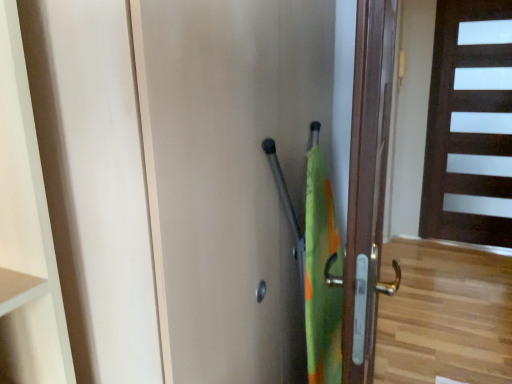
What do you see at coordinates (260, 186) in the screenshot? I see `matte wood door at center, which is the first door in left-to-right order` at bounding box center [260, 186].

Find the location of a particular element. brown wooden door at right, the 2th door when ordered from back to front is located at coordinates (367, 186).

In order to click on dark wood door at right, the 1th door viewed from the back in this screenshot , I will do `click(470, 125)`.

Identify the location of matte wood door at center, positioned as the 1th door in front-to-back order. Image resolution: width=512 pixels, height=384 pixels. (260, 186).

Is dark wood door at right, which is the third door in front-to-back order, aimed at matte wood door at center, marked as the 3th door in a right-to-left arrangement?

Yes, dark wood door at right, which is the third door in front-to-back order, is turned towards matte wood door at center, marked as the 3th door in a right-to-left arrangement.

Which is in front, point (468, 45) or point (316, 232)?

The point (316, 232) is closer.

The height and width of the screenshot is (384, 512). I want to click on door that is the 2nd object to the right of the matte wood door at center, marked as the 3th door in a right-to-left arrangement, starting at the anchor, so click(470, 125).

Considering the positions of objects dark wood door at right, which is the third door in front-to-back order, and matte wood door at center, marked as the 3th door in a right-to-left arrangement, in the image provided, who is in front, dark wood door at right, which is the third door in front-to-back order, or matte wood door at center, marked as the 3th door in a right-to-left arrangement,?

matte wood door at center, marked as the 3th door in a right-to-left arrangement, is closer to the camera.

How far apart are dark wood door at right, acting as the first door starting from the right, and brown wooden door at right, which is the second door from right to left?

dark wood door at right, acting as the first door starting from the right, is 8.93 feet from brown wooden door at right, which is the second door from right to left.

Is dark wood door at right, which is the third door in front-to-back order, next to brown wooden door at right, the 2th door in the front-to-back sequence?

No, dark wood door at right, which is the third door in front-to-back order, is not next to brown wooden door at right, the 2th door in the front-to-back sequence.

Which point is more distant from viewer, (457, 89) or (373, 372)?

The point (457, 89) is farther.

Which object is positioned more to the left, dark wood door at right, which is the third door in front-to-back order, or brown wooden door at right, the 2th door in the front-to-back sequence?

brown wooden door at right, the 2th door in the front-to-back sequence.

How different are the orientations of brown wooden door at right, the 2th door when ordered from back to front, and dark wood door at right, which is counted as the third door, starting from the left, in degrees?

They differ by 7.49 degrees in their facing directions.

Between brown wooden door at right, the 2th door in the front-to-back sequence, and dark wood door at right, which is the third door in front-to-back order, which one has smaller size?

brown wooden door at right, the 2th door in the front-to-back sequence.

Considering the sizes of objects brown wooden door at right, which appears as the 2th door when viewed from the left, and dark wood door at right, acting as the first door starting from the right, in the image provided, who is wider, brown wooden door at right, which appears as the 2th door when viewed from the left, or dark wood door at right, acting as the first door starting from the right,?

brown wooden door at right, which appears as the 2th door when viewed from the left.

This screenshot has width=512, height=384. Find the location of `the 2nd door in front of the dark wood door at right, acting as the first door starting from the right`. the 2nd door in front of the dark wood door at right, acting as the first door starting from the right is located at coordinates (260, 186).

Is the depth of matte wood door at center, marked as the 3th door in a right-to-left arrangement, less than that of dark wood door at right, which is the third door in front-to-back order?

That is True.

From the image's perspective, who appears lower, matte wood door at center, positioned as the 1th door in front-to-back order, or dark wood door at right, the 1th door viewed from the back?

matte wood door at center, positioned as the 1th door in front-to-back order, appears lower in the image.

Based on their positions, is matte wood door at center, positioned as the 1th door in front-to-back order, located to the left or right of brown wooden door at right, the 2th door in the front-to-back sequence?

matte wood door at center, positioned as the 1th door in front-to-back order, is positioned on brown wooden door at right, the 2th door in the front-to-back sequence,'s left side.

How distant is matte wood door at center, the third door positioned from the back, from brown wooden door at right, the 2th door when ordered from back to front?

matte wood door at center, the third door positioned from the back, is 6.57 inches away from brown wooden door at right, the 2th door when ordered from back to front.

Between matte wood door at center, the third door positioned from the back, and brown wooden door at right, which is the second door from right to left, which one has more height?

With more height is matte wood door at center, the third door positioned from the back.

Relative to brown wooden door at right, the 2th door when ordered from back to front, is matte wood door at center, which is the first door in left-to-right order, in front or behind?

matte wood door at center, which is the first door in left-to-right order, is in front of brown wooden door at right, the 2th door when ordered from back to front.

Is brown wooden door at right, the 2th door in the front-to-back sequence, in front of matte wood door at center, the third door positioned from the back?

No, brown wooden door at right, the 2th door in the front-to-back sequence, is further to the viewer.

Between brown wooden door at right, which is the second door from right to left, and matte wood door at center, positioned as the 1th door in front-to-back order, which one appears on the left side from the viewer's perspective?

matte wood door at center, positioned as the 1th door in front-to-back order, is more to the left.

Does brown wooden door at right, the 2th door in the front-to-back sequence, have a greater width compared to matte wood door at center, the third door positioned from the back?

Yes, brown wooden door at right, the 2th door in the front-to-back sequence, is wider than matte wood door at center, the third door positioned from the back.

Find the location of `door that is the 2nd one when counting forward from the dark wood door at right, which is the third door in front-to-back order`. door that is the 2nd one when counting forward from the dark wood door at right, which is the third door in front-to-back order is located at coordinates (260, 186).

From the dark wood door at right, which is counted as the third door, starting from the left, count the 1st door to the left and point to it. Please provide its 2D coordinates.

[(367, 186)]

From the image, which object appears to be nearer to matte wood door at center, which is the first door in left-to-right order, dark wood door at right, which is counted as the third door, starting from the left, or brown wooden door at right, the 2th door in the front-to-back sequence?

Among the two, brown wooden door at right, the 2th door in the front-to-back sequence, is located nearer to matte wood door at center, which is the first door in left-to-right order.

Looking at the image, which one is located further to dark wood door at right, acting as the first door starting from the right, brown wooden door at right, which is the second door from right to left, or matte wood door at center, marked as the 3th door in a right-to-left arrangement?

matte wood door at center, marked as the 3th door in a right-to-left arrangement, is further to dark wood door at right, acting as the first door starting from the right.

When comparing their distances from brown wooden door at right, which is the second door from right to left, does matte wood door at center, the third door positioned from the back, or dark wood door at right, which is counted as the third door, starting from the left, seem further?

dark wood door at right, which is counted as the third door, starting from the left.

From the image, which object appears to be nearer to dark wood door at right, acting as the first door starting from the right, matte wood door at center, positioned as the 1th door in front-to-back order, or brown wooden door at right, which appears as the 2th door when viewed from the left?

The object closer to dark wood door at right, acting as the first door starting from the right, is brown wooden door at right, which appears as the 2th door when viewed from the left.

From the image, which object appears to be farther from matte wood door at center, which is the first door in left-to-right order, brown wooden door at right, the 2th door in the front-to-back sequence, or dark wood door at right, which is the third door in front-to-back order?

Based on the image, dark wood door at right, which is the third door in front-to-back order, appears to be further to matte wood door at center, which is the first door in left-to-right order.

Estimate the real-world distances between objects in this image. Which object is closer to brown wooden door at right, the 2th door when ordered from back to front, dark wood door at right, the 1th door viewed from the back, or matte wood door at center, which is the first door in left-to-right order?

Based on the image, matte wood door at center, which is the first door in left-to-right order, appears to be nearer to brown wooden door at right, the 2th door when ordered from back to front.

Where is `door positioned between matte wood door at center, marked as the 3th door in a right-to-left arrangement, and dark wood door at right, which is the third door in front-to-back order, from near to far`? door positioned between matte wood door at center, marked as the 3th door in a right-to-left arrangement, and dark wood door at right, which is the third door in front-to-back order, from near to far is located at coordinates (367, 186).